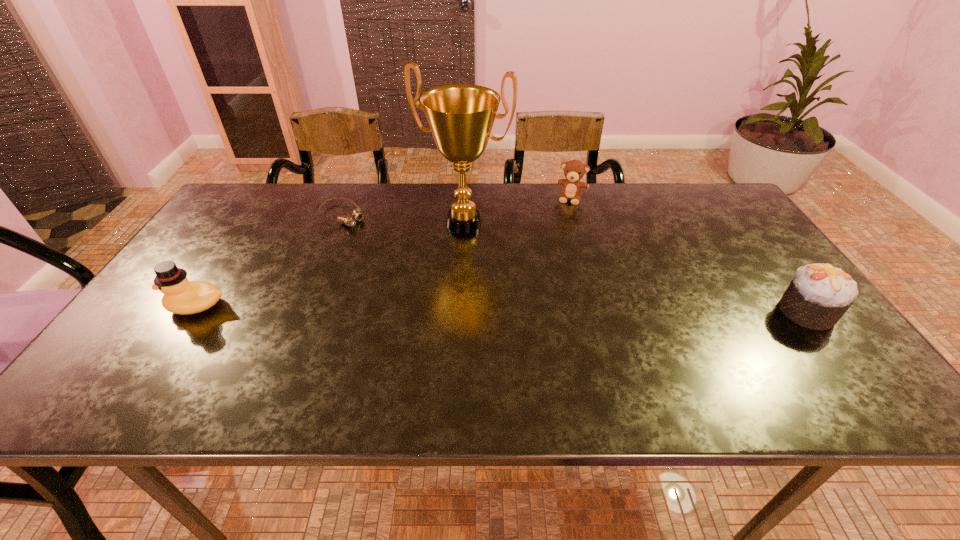
At what (x,y) coordinates should I click in order to perform the action: click on free point that satisfies the following two spatial constraints: 1. on the back side of the teddy bear; 2. on the left side of the shortest object. Please return your answer as a coordinate pair (x, y). This screenshot has width=960, height=540. Looking at the image, I should click on (349, 198).

You are a GUI agent. You are given a task and a screenshot of the screen. Output one action in this format:
    pyautogui.click(x=<x>, y=<y>)
    Task: Click on the free location that satisfies the following two spatial constraints: 1. on the front side of the cupcake; 2. on the right side of the teddy bear
    The height and width of the screenshot is (540, 960).
    Given the screenshot: What is the action you would take?
    pyautogui.click(x=604, y=312)